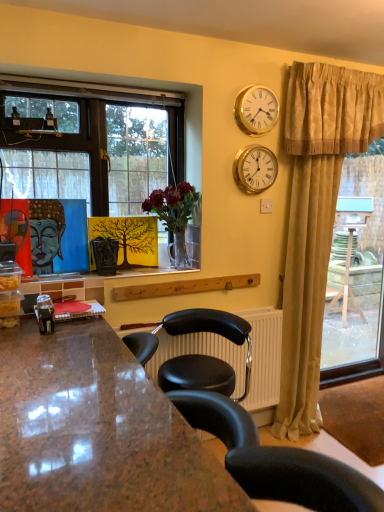
Question: Is matte blue buddha at left at the right side of gold metallic clock at upper right, the 2th clock positioned from the bottom?

Choices:
 (A) no
 (B) yes

Answer: (A)

Question: From a real-world perspective, is matte blue buddha at left positioned under gold metallic clock at upper right, acting as the 1th clock starting from the top, based on gravity?

Choices:
 (A) yes
 (B) no

Answer: (A)

Question: Is matte blue buddha at left positioned before gold metallic clock at upper right, the 2th clock positioned from the bottom?

Choices:
 (A) no
 (B) yes

Answer: (B)

Question: Does matte blue buddha at left have a smaller size compared to gold metallic clock at upper right, acting as the 1th clock starting from the top?

Choices:
 (A) yes
 (B) no

Answer: (B)

Question: Is matte blue buddha at left surrounding gold metallic clock at upper right, the 2th clock positioned from the bottom?

Choices:
 (A) yes
 (B) no

Answer: (B)

Question: Does point (46, 224) appear closer or farther from the camera than point (261, 108)?

Choices:
 (A) closer
 (B) farther

Answer: (A)

Question: Is matte blue buddha at left in front of or behind gold metallic clock at upper right, the 2th clock positioned from the bottom, in the image?

Choices:
 (A) front
 (B) behind

Answer: (A)

Question: Considering the positions of matte blue buddha at left and gold metallic clock at upper right, acting as the 1th clock starting from the top, in the image, is matte blue buddha at left wider or thinner than gold metallic clock at upper right, acting as the 1th clock starting from the top,?

Choices:
 (A) thin
 (B) wide

Answer: (B)

Question: From the image's perspective, is matte blue buddha at left above or below gold metallic clock at upper right, acting as the 1th clock starting from the top?

Choices:
 (A) below
 (B) above

Answer: (A)

Question: Is painted wood window sill at center in front of or behind marble countertop at lower left in the image?

Choices:
 (A) front
 (B) behind

Answer: (B)

Question: Is point (132, 274) closer or farther from the camera than point (41, 471)?

Choices:
 (A) farther
 (B) closer

Answer: (A)

Question: In the image, is painted wood window sill at center on the left side or the right side of marble countertop at lower left?

Choices:
 (A) left
 (B) right

Answer: (A)

Question: Which is correct: painted wood window sill at center is inside marble countertop at lower left, or outside of it?

Choices:
 (A) outside
 (B) inside

Answer: (A)

Question: Is matte blue buddha at left inside the boundaries of marble countertop at lower left, or outside?

Choices:
 (A) inside
 (B) outside

Answer: (B)

Question: Based on their sizes in the image, would you say matte blue buddha at left is bigger or smaller than marble countertop at lower left?

Choices:
 (A) small
 (B) big

Answer: (A)